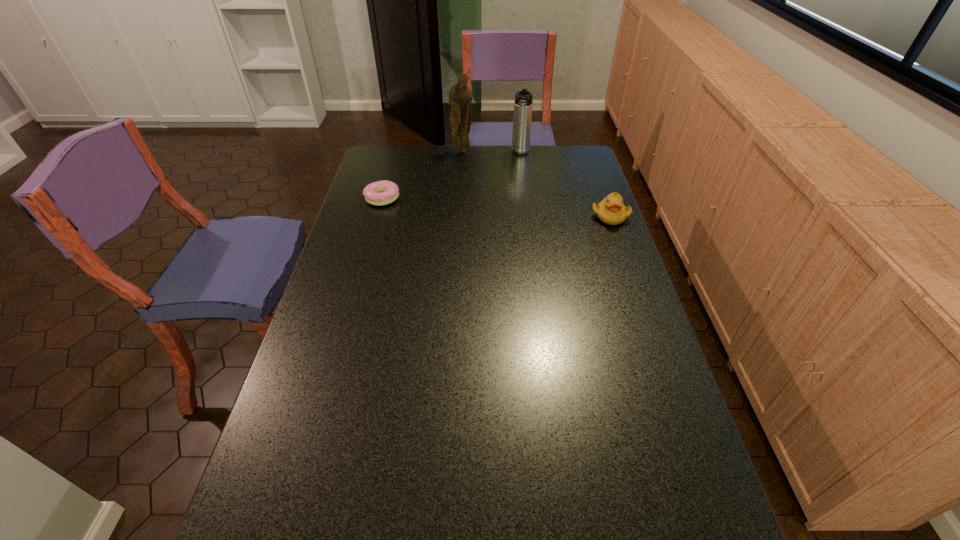
The image size is (960, 540). I want to click on the shortest object, so click(x=384, y=192).

Image resolution: width=960 pixels, height=540 pixels. I want to click on doughnut, so click(x=384, y=192).

I want to click on the third tallest object, so click(x=611, y=210).

Find the location of `duckling`. duckling is located at coordinates (611, 210).

Where is `the second object from left to right`? This screenshot has width=960, height=540. the second object from left to right is located at coordinates (460, 99).

Locate an element on the screen. This screenshot has height=540, width=960. the tallest object is located at coordinates (460, 99).

Where is `the third shortest object`? The height and width of the screenshot is (540, 960). the third shortest object is located at coordinates (522, 118).

This screenshot has width=960, height=540. What are the coordinates of `thermos bottle` in the screenshot? It's located at point(522,118).

Where is `vacant space situated on the back of the shortest object`? vacant space situated on the back of the shortest object is located at coordinates (389, 177).

Image resolution: width=960 pixels, height=540 pixels. Identify the location of free spot located on the front-facing side of the third tallest object. (631, 275).